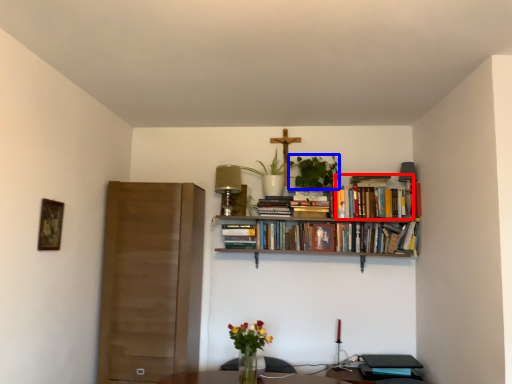
Question: Which of the following is the closest to the observer, book (highlighted by a red box) or plant (highlighted by a blue box)?

Choices:
 (A) book
 (B) plant

Answer: (B)